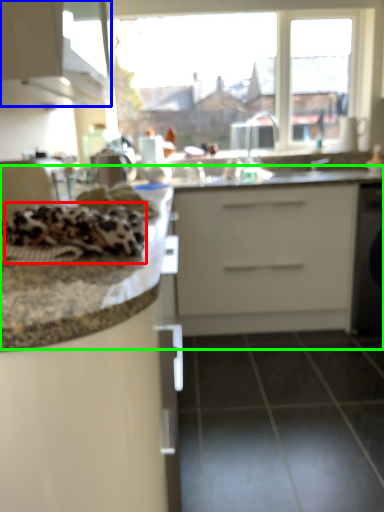
Question: Which is farther away from material (highlighted by a red box)? cabinetry (highlighted by a blue box) or counter top (highlighted by a green box)?

Choices:
 (A) cabinetry
 (B) counter top

Answer: (B)